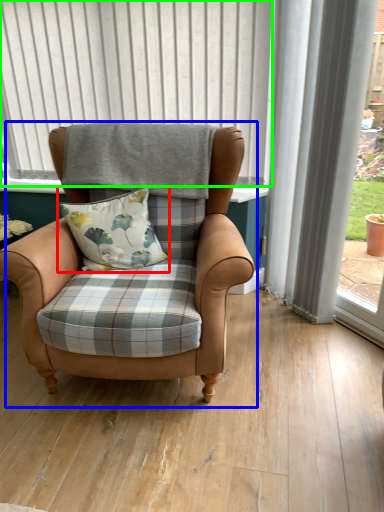
Question: Which is nearer to the pillow (highlighted by a red box)? chair (highlighted by a blue box) or bay window (highlighted by a green box).

Choices:
 (A) chair
 (B) bay window

Answer: (A)